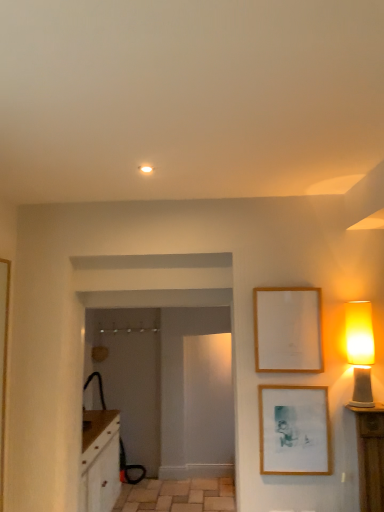
Question: Considering the relative sizes of matte wooden picture frame at lower right, positioned as the 1th picture frame in bottom-to-top order, and wooden picture frame at upper right, which ranks as the second picture frame in bottom-to-top order, in the image provided, is matte wooden picture frame at lower right, positioned as the 1th picture frame in bottom-to-top order, bigger than wooden picture frame at upper right, which ranks as the second picture frame in bottom-to-top order,?

Choices:
 (A) no
 (B) yes

Answer: (A)

Question: From the image's perspective, is matte wooden picture frame at lower right, the second picture frame when ordered from top to bottom, over wooden picture frame at upper right, the first picture frame in the top-to-bottom sequence?

Choices:
 (A) yes
 (B) no

Answer: (B)

Question: Is matte wooden picture frame at lower right, the second picture frame when ordered from top to bottom, directly adjacent to wooden picture frame at upper right, which ranks as the second picture frame in bottom-to-top order?

Choices:
 (A) yes
 (B) no

Answer: (B)

Question: Does matte wooden picture frame at lower right, the second picture frame when ordered from top to bottom, lie behind wooden picture frame at upper right, the first picture frame in the top-to-bottom sequence?

Choices:
 (A) no
 (B) yes

Answer: (A)

Question: Could wooden picture frame at upper right, the first picture frame in the top-to-bottom sequence, be considered to be inside matte wooden picture frame at lower right, the second picture frame when ordered from top to bottom?

Choices:
 (A) yes
 (B) no

Answer: (B)

Question: Looking at their shapes, would you say matte yellow glass lampshade at right is wider or thinner than matte wooden picture frame at lower right, positioned as the 1th picture frame in bottom-to-top order?

Choices:
 (A) thin
 (B) wide

Answer: (B)

Question: Would you say matte yellow glass lampshade at right is to the left or to the right of matte wooden picture frame at lower right, positioned as the 1th picture frame in bottom-to-top order, in the picture?

Choices:
 (A) right
 (B) left

Answer: (A)

Question: Is matte yellow glass lampshade at right situated inside matte wooden picture frame at lower right, positioned as the 1th picture frame in bottom-to-top order, or outside?

Choices:
 (A) inside
 (B) outside

Answer: (B)

Question: From a real-world perspective, is matte yellow glass lampshade at right above or below matte wooden picture frame at lower right, positioned as the 1th picture frame in bottom-to-top order?

Choices:
 (A) above
 (B) below

Answer: (A)

Question: Is natural stone tile at lower center inside the boundaries of matte wooden picture frame at lower right, positioned as the 1th picture frame in bottom-to-top order, or outside?

Choices:
 (A) inside
 (B) outside

Answer: (B)

Question: From the image's perspective, relative to matte wooden picture frame at lower right, the second picture frame when ordered from top to bottom, is natural stone tile at lower center above or below?

Choices:
 (A) above
 (B) below

Answer: (B)

Question: Considering their positions, is natural stone tile at lower center located in front of or behind matte wooden picture frame at lower right, the second picture frame when ordered from top to bottom?

Choices:
 (A) behind
 (B) front

Answer: (A)

Question: Looking at the image, does natural stone tile at lower center seem bigger or smaller compared to matte wooden picture frame at lower right, positioned as the 1th picture frame in bottom-to-top order?

Choices:
 (A) small
 (B) big

Answer: (B)

Question: From the image's perspective, relative to wooden picture frame at upper right, the first picture frame in the top-to-bottom sequence, is matte wooden picture frame at lower right, the second picture frame when ordered from top to bottom, above or below?

Choices:
 (A) above
 (B) below

Answer: (B)

Question: Considering the positions of matte wooden picture frame at lower right, positioned as the 1th picture frame in bottom-to-top order, and wooden picture frame at upper right, the first picture frame in the top-to-bottom sequence, in the image, is matte wooden picture frame at lower right, positioned as the 1th picture frame in bottom-to-top order, taller or shorter than wooden picture frame at upper right, the first picture frame in the top-to-bottom sequence,?

Choices:
 (A) tall
 (B) short

Answer: (B)